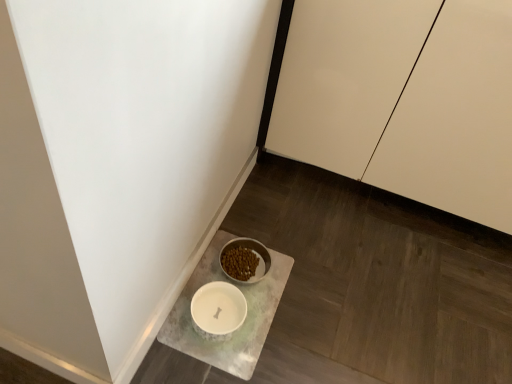
Locate an element on the screen. This screenshot has width=512, height=384. white matte cabinet at upper right is located at coordinates (x=405, y=100).

The width and height of the screenshot is (512, 384). What do you see at coordinates (405, 100) in the screenshot?
I see `white matte cabinet at upper right` at bounding box center [405, 100].

At what (x,y) coordinates should I click in order to perform the action: click on white marble tray at lower center. Please return your answer as a coordinate pair (x, y). The image size is (512, 384). Looking at the image, I should click on (244, 321).

What do you see at coordinates (244, 321) in the screenshot? I see `white marble tray at lower center` at bounding box center [244, 321].

What is the approximate width of white marble tray at lower center?

white marble tray at lower center is 11.24 inches in width.

Find the location of `white matte cabinet at upper right`. white matte cabinet at upper right is located at coordinates (405, 100).

From the picture: Which object is positioned more to the right, white marble tray at lower center or white matte cabinet at upper right?

white matte cabinet at upper right.

Which object is further away from the camera, white marble tray at lower center or white matte cabinet at upper right?

Positioned behind is white marble tray at lower center.

Considering the points (249, 324) and (372, 147), which point is in front, point (249, 324) or point (372, 147)?

The point (249, 324) is more forward.

From the image's perspective, who appears lower, white marble tray at lower center or white matte cabinet at upper right?

From the image's view, white marble tray at lower center is below.

From a real-world perspective, is white marble tray at lower center positioned above or below white matte cabinet at upper right?

white marble tray at lower center is below white matte cabinet at upper right.

Looking at their sizes, would you say white marble tray at lower center is wider or thinner than white matte cabinet at upper right?

Considering their sizes, white marble tray at lower center looks slimmer than white matte cabinet at upper right.

Considering the sizes of objects white marble tray at lower center and white matte cabinet at upper right in the image provided, who is shorter, white marble tray at lower center or white matte cabinet at upper right?

Standing shorter between the two is white marble tray at lower center.

Considering the sizes of objects white marble tray at lower center and white matte cabinet at upper right in the image provided, who is bigger, white marble tray at lower center or white matte cabinet at upper right?

white matte cabinet at upper right.

Is white matte cabinet at upper right surrounded by white marble tray at lower center?

No, white matte cabinet at upper right is not inside white marble tray at lower center.

Are white marble tray at lower center and white matte cabinet at upper right far apart?

No, white marble tray at lower center is not far away from white matte cabinet at upper right.

Is white marble tray at lower center oriented away from white matte cabinet at upper right?

No.

What's the angular difference between white marble tray at lower center and white matte cabinet at upper right's facing directions?

90.3 degrees.

Measure the distance from white marble tray at lower center to white matte cabinet at upper right.

white marble tray at lower center and white matte cabinet at upper right are 26.58 inches apart from each other.

This screenshot has width=512, height=384. I want to click on cabinetry that appears above the white marble tray at lower center (from a real-world perspective), so click(405, 100).

In the image, is white matte cabinet at upper right on the left side or the right side of white marble tray at lower center?

Based on their positions, white matte cabinet at upper right is located to the right of white marble tray at lower center.

Is white matte cabinet at upper right in front of or behind white marble tray at lower center in the image?

white matte cabinet at upper right is in front of white marble tray at lower center.

Is point (377, 35) closer to viewer compared to point (228, 352)?

No, (377, 35) is further to viewer.

From the image's perspective, does white matte cabinet at upper right appear higher than white marble tray at lower center?

Yes, from the image's perspective, white matte cabinet at upper right is on top of white marble tray at lower center.

From a real-world perspective, who is located higher, white matte cabinet at upper right or white marble tray at lower center?

From a 3D spatial view, white matte cabinet at upper right is above.

Does white matte cabinet at upper right have a greater width compared to white marble tray at lower center?

Correct, the width of white matte cabinet at upper right exceeds that of white marble tray at lower center.

Considering the relative sizes of white matte cabinet at upper right and white marble tray at lower center in the image provided, is white matte cabinet at upper right taller than white marble tray at lower center?

Indeed, white matte cabinet at upper right has a greater height compared to white marble tray at lower center.

Based on their sizes in the image, would you say white matte cabinet at upper right is bigger or smaller than white marble tray at lower center?

Clearly, white matte cabinet at upper right is larger in size than white marble tray at lower center.

Does white matte cabinet at upper right contain white marble tray at lower center?

Actually, white marble tray at lower center is outside white matte cabinet at upper right.

Can you see white matte cabinet at upper right touching white marble tray at lower center?

There is a gap between white matte cabinet at upper right and white marble tray at lower center.

Could you tell me if white matte cabinet at upper right is turned towards white marble tray at lower center?

Yes, white matte cabinet at upper right is aimed at white marble tray at lower center.

Can you tell me how much white matte cabinet at upper right and white marble tray at lower center differ in facing direction?

They differ by 90.3 degrees in their facing directions.

At what (x,y) coordinates should I click in order to perform the action: click on counter on the left of white matte cabinet at upper right. Please return your answer as a coordinate pair (x, y). The height and width of the screenshot is (384, 512). Looking at the image, I should click on (244, 321).

The height and width of the screenshot is (384, 512). In order to click on cabinetry in front of the white marble tray at lower center in this screenshot , I will do `click(405, 100)`.

Where is `counter that is under the white matte cabinet at upper right (from a real-world perspective)`? counter that is under the white matte cabinet at upper right (from a real-world perspective) is located at coordinates (244, 321).